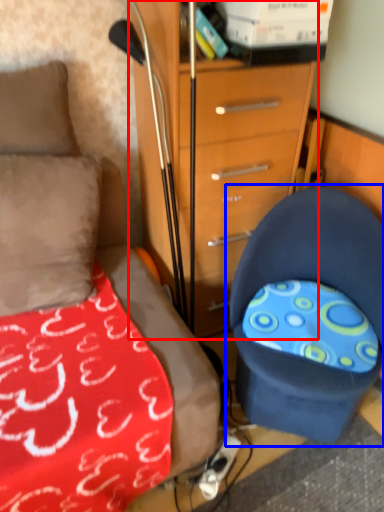
Question: Which point is closer to the camera, chest of drawers (highlighted by a red box) or chair (highlighted by a blue box)?

Choices:
 (A) chest of drawers
 (B) chair

Answer: (B)